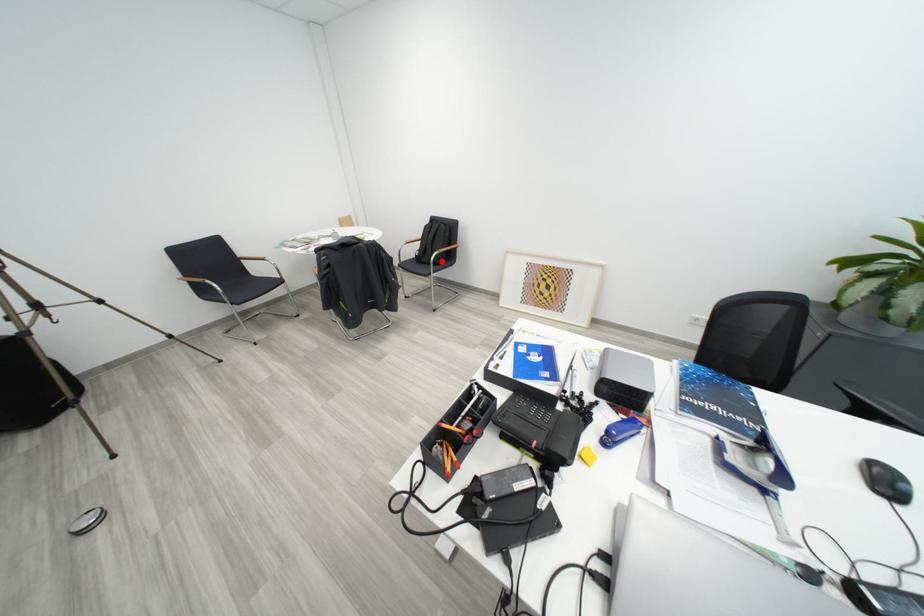
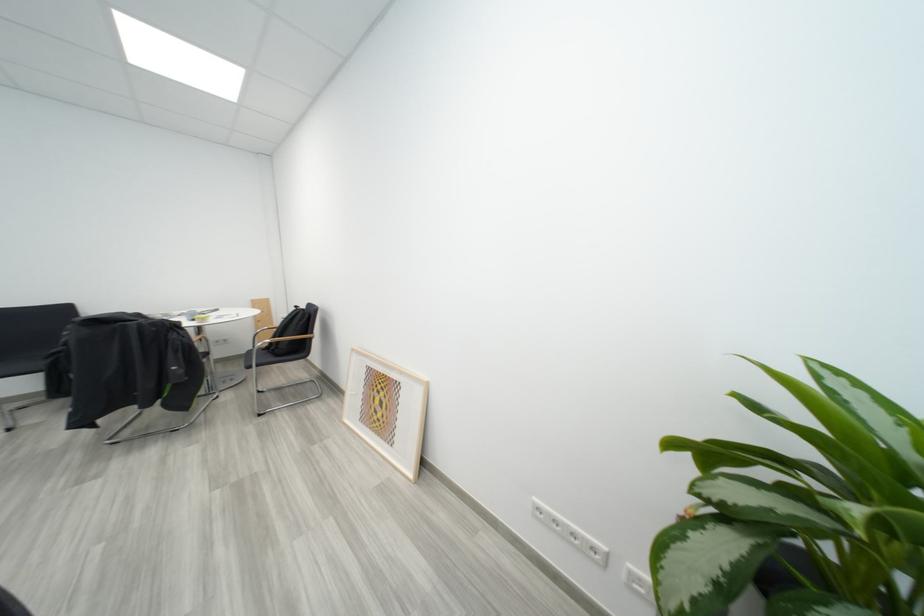
Question: I am providing you with two images of the same scene from different viewpoints. A red point is marked on the first image. At the location where the point appears in image 1, is it still visible in image 2?

Choices:
 (A) Yes
 (B) No

Answer: (B)